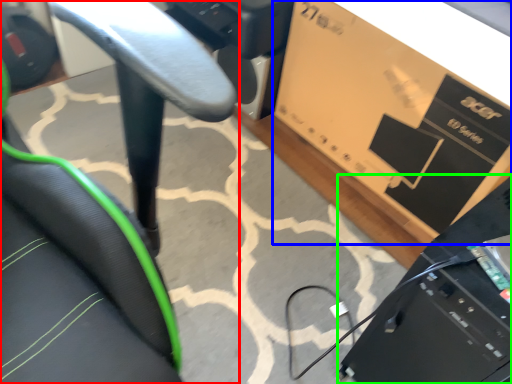
Question: Which is farther away from chair (highlighted by a red box)? cardboard box (highlighted by a blue box) or computer (highlighted by a green box)?

Choices:
 (A) cardboard box
 (B) computer

Answer: (A)